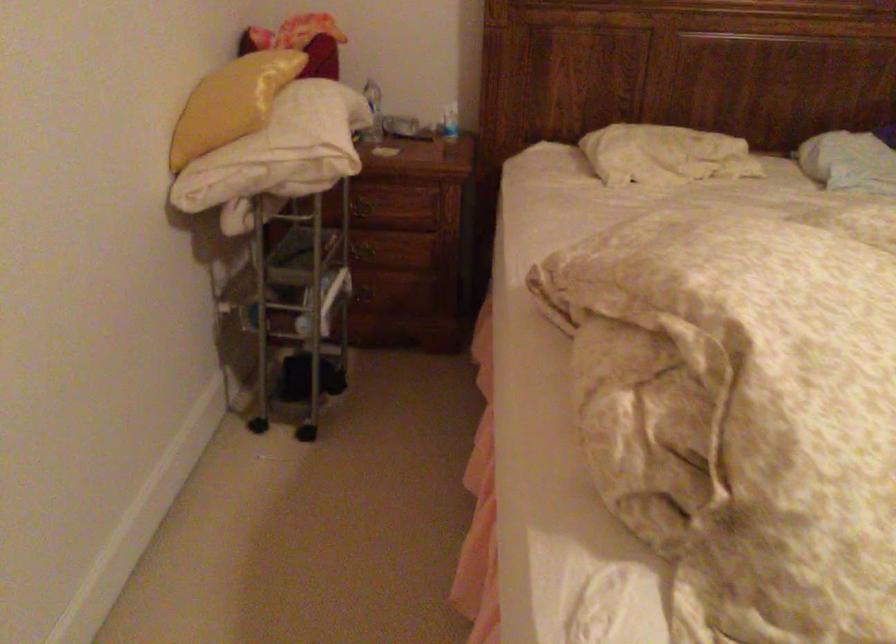
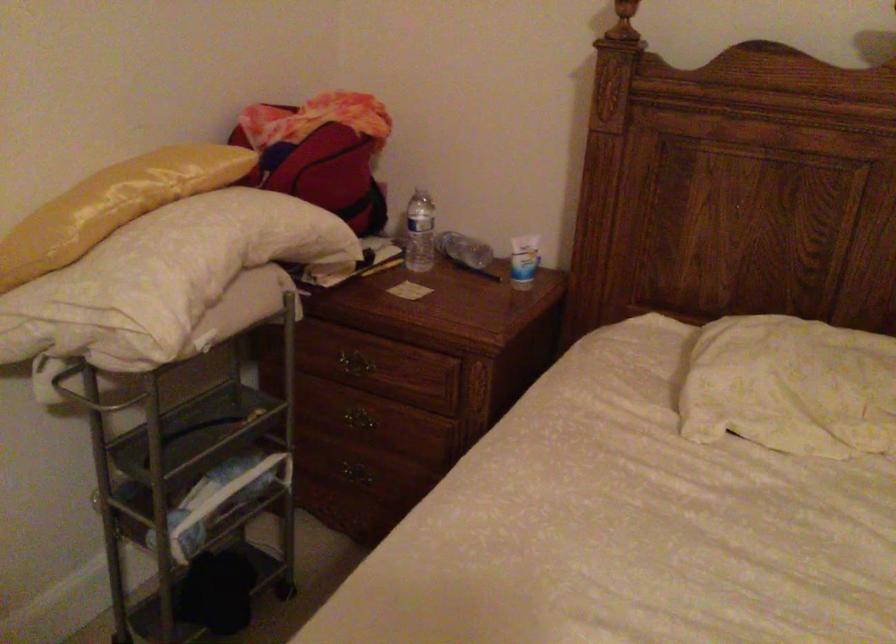
Find the pixel in the second image that matches point 382,113 in the first image.

(419, 232)